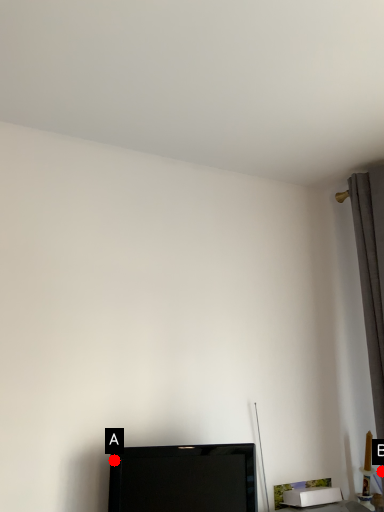
Question: Two points are circled on the image, labeled by A and B beside each circle. Which point is closer to the camera taking this photo?

Choices:
 (A) A is closer
 (B) B is closer

Answer: (A)